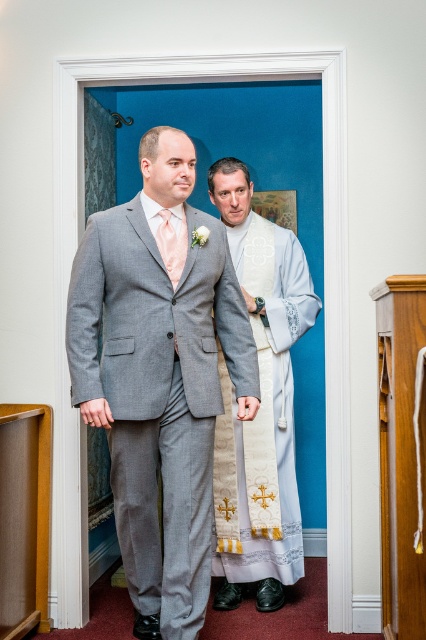
Question: Does gray wool suit at center appear over white lace dress at right?

Choices:
 (A) no
 (B) yes

Answer: (B)

Question: Which point is closer to the camera?

Choices:
 (A) gray wool suit at center
 (B) peach satin tie at center
 (C) white lace dress at right

Answer: (A)

Question: Which object appears closest to the camera in this image?

Choices:
 (A) gray wool suit at center
 (B) peach satin tie at center

Answer: (A)

Question: Is gray wool suit at center further to camera compared to peach satin tie at center?

Choices:
 (A) no
 (B) yes

Answer: (A)

Question: Does white lace dress at right have a greater width compared to peach satin tie at center?

Choices:
 (A) no
 (B) yes

Answer: (B)

Question: Which point appears closest to the camera in this image?

Choices:
 (A) (276, 502)
 (B) (158, 211)

Answer: (B)